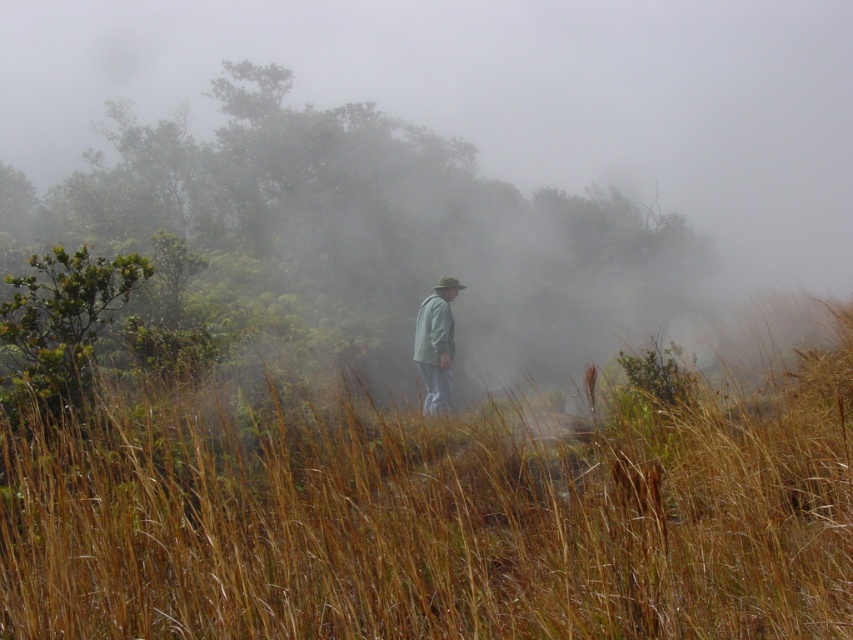
Question: Can you confirm if foggy mist at center is thinner than green leafy bush at upper left?

Choices:
 (A) yes
 (B) no

Answer: (B)

Question: Is foggy mist at center above light gray fabric jacket at center?

Choices:
 (A) no
 (B) yes

Answer: (B)

Question: Which of the following is the closest to the observer?

Choices:
 (A) green leafy bush at upper left
 (B) foggy mist at center
 (C) light gray fabric jacket at center
 (D) brown dry grass at center

Answer: (D)

Question: Among these objects, which one is farthest from the camera?

Choices:
 (A) brown dry grass at center
 (B) foggy mist at center
 (C) light gray fabric jacket at center
 (D) green leafy bush at upper left

Answer: (B)

Question: Which of the following is the closest to the observer?

Choices:
 (A) brown dry grass at center
 (B) foggy mist at center
 (C) light gray fabric jacket at center

Answer: (A)

Question: Is foggy mist at center wider than light gray fabric jacket at center?

Choices:
 (A) no
 (B) yes

Answer: (B)